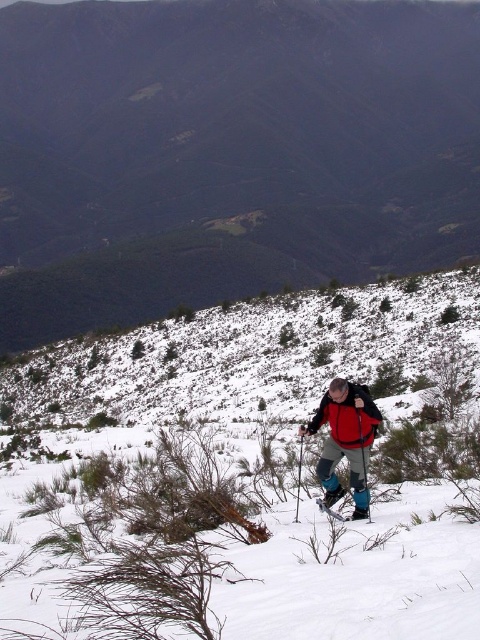
Question: Among these objects, which one is nearest to the camera?

Choices:
 (A) red fabric jacket at center
 (B) white snow at center
 (C) red fleece jacket at center

Answer: (B)

Question: Among these points, which one is farthest from the camera?

Choices:
 (A) pos(336,515)
 (B) pos(463,536)

Answer: (A)

Question: Is red fabric jacket at center closer to camera compared to blue plastic ski at lower center?

Choices:
 (A) no
 (B) yes

Answer: (B)

Question: Observing the image, what is the correct spatial positioning of snowy mountain at center in reference to red fabric jacket at center?

Choices:
 (A) above
 (B) below

Answer: (A)

Question: Which point is closer to the camera taking this photo?

Choices:
 (A) (116, 196)
 (B) (300, 460)
 (C) (363, 416)
 (D) (368, 520)

Answer: (C)

Question: Does red fabric jacket at center appear under red fleece jacket at center?

Choices:
 (A) no
 (B) yes

Answer: (B)